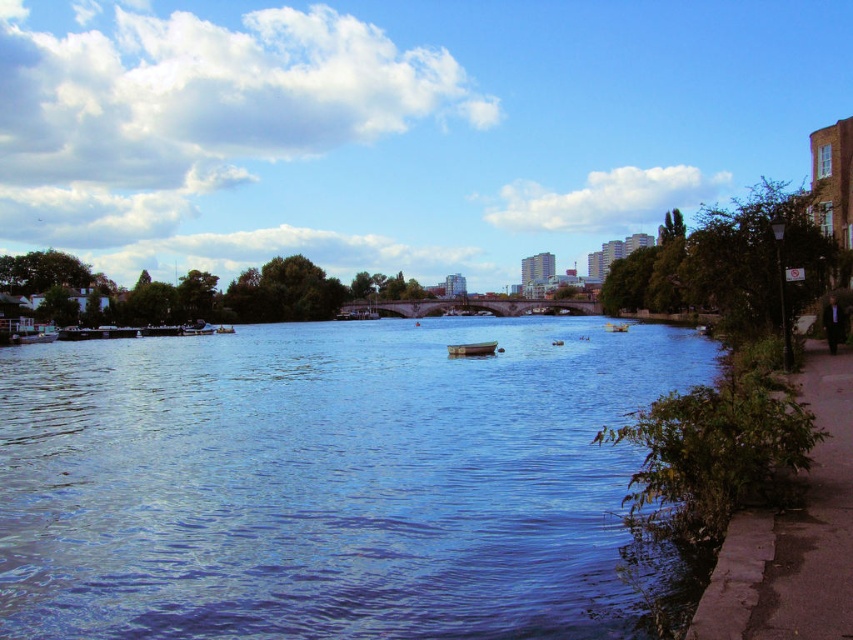
You are planning to cross the river using a boat. The wooden boat at center can carry up to 3 people, while the yellow plastic boat at center can carry up to 5 people. Which boat should you choose if you have a group of 4 people?

The yellow plastic boat at center can carry up to 5 people, so you should choose the yellow plastic boat at center for your group of 4 people.

You are planning to take a photo of the blue water at center and the yellow plastic boat at center from the riverside path. Which object should you focus on first if you want to capture both in a single frame without moving the camera?

The blue water at center has a larger size compared to the yellow plastic boat at center, so you should focus on the blue water at center first to ensure it fills the frame appropriately before adjusting for the boat.